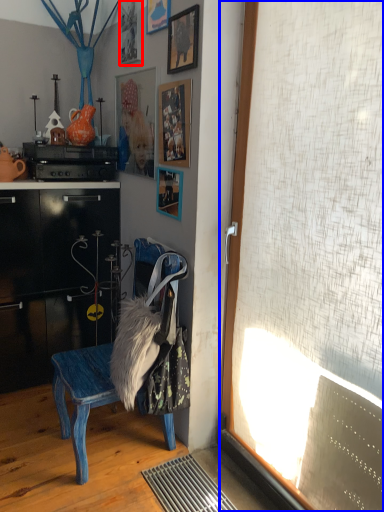
Question: Which object is closer to the camera taking this photo, picture frame (highlighted by a red box) or window screen (highlighted by a blue box)?

Choices:
 (A) picture frame
 (B) window screen

Answer: (B)